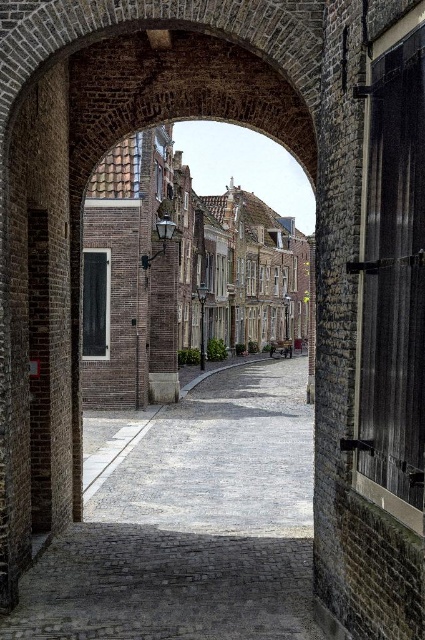
Based on the photo, you are standing in front of the brick archway and want to see the top of the gray cobblestone alley at center and the brick building at center. Which one will you need to look up more to see its top?

The brick building at center is taller than the gray cobblestone alley at center, so you will need to look up more to see the top of the brick building at center.

From the picture: You are a tourist standing in front of the brick archway and want to walk into the gray cobblestone alley at center and the brick building at center. Which one is located to your left side?

The gray cobblestone alley at center is positioned on the left side of brick building at center, so the gray cobblestone alley at center is on your left side.

You are standing in front of the brick archway and want to walk into the gray cobblestone alley at center. Which direction should you move relative to the brick building at center?

The gray cobblestone alley at center is located below the brick building at center, so you should move downward towards the gray cobblestone alley at center to enter it.